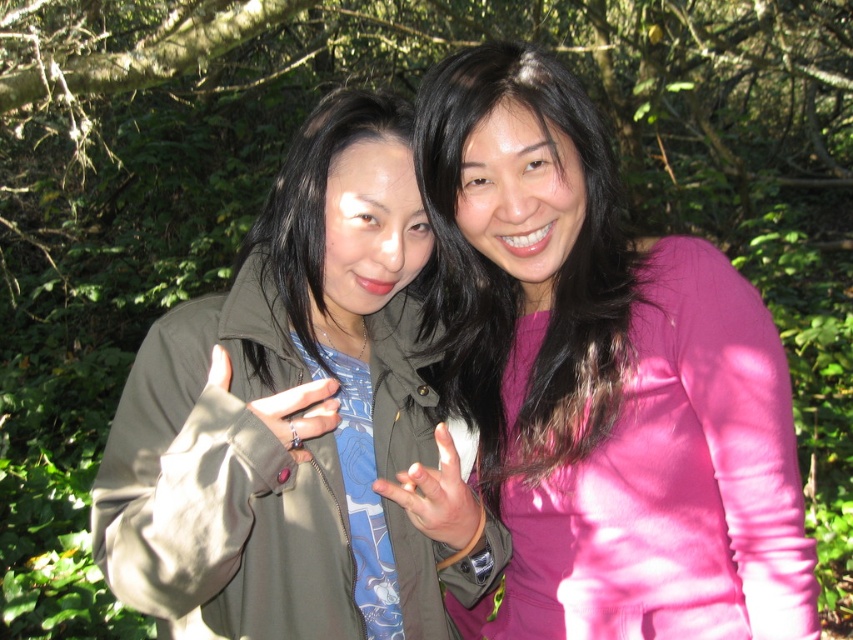
Which is behind, point (293, 472) or point (579, 106)?

Positioned behind is point (579, 106).

Looking at this image, between matte olive green jacket at center and pink matte shirt at center, which one appears on the right side from the viewer's perspective?

From the viewer's perspective, pink matte shirt at center appears more on the right side.

Is point (280, 307) in front of point (434, 308)?

Yes, it is.

Locate an element on the screen. Image resolution: width=853 pixels, height=640 pixels. matte olive green jacket at center is located at coordinates (286, 413).

Who is shorter, matte olive green jacket at center or matte green jacket at center?

With less height is matte green jacket at center.

This screenshot has width=853, height=640. What do you see at coordinates (286, 413) in the screenshot?
I see `matte olive green jacket at center` at bounding box center [286, 413].

You are a GUI agent. You are given a task and a screenshot of the screen. Output one action in this format:
    pyautogui.click(x=<x>, y=<y>)
    Task: Click on the matte olive green jacket at center
    The height and width of the screenshot is (640, 853).
    Given the screenshot: What is the action you would take?
    pyautogui.click(x=286, y=413)

I want to click on matte olive green jacket at center, so click(x=286, y=413).

What do you see at coordinates (602, 380) in the screenshot?
I see `pink satin blouse at center` at bounding box center [602, 380].

Is pink satin blouse at center smaller than matte black ring at center?

Incorrect, pink satin blouse at center is not smaller in size than matte black ring at center.

Is point (618, 474) positioned behind point (224, 374)?

Yes, it is behind point (224, 374).

Identify the location of pink satin blouse at center. (602, 380).